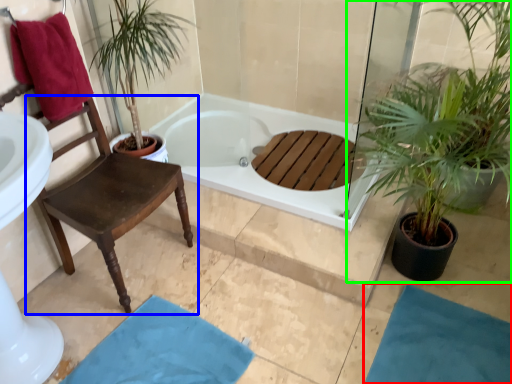
Question: Considering the real-world distances, which object is farthest from bath mat (highlighted by a red box)? chair (highlighted by a blue box) or houseplant (highlighted by a green box)?

Choices:
 (A) chair
 (B) houseplant

Answer: (A)